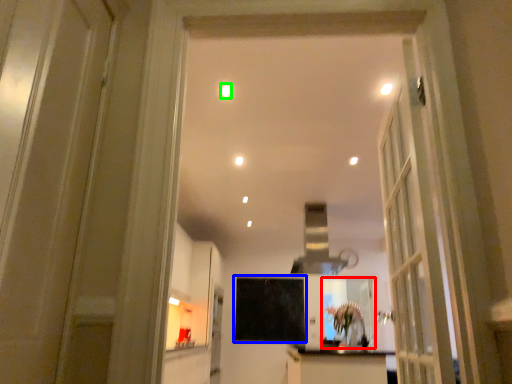
Question: Which is nearer to the mirror (highlighted by a red box)? screen door (highlighted by a blue box) or lighting (highlighted by a green box).

Choices:
 (A) screen door
 (B) lighting

Answer: (A)